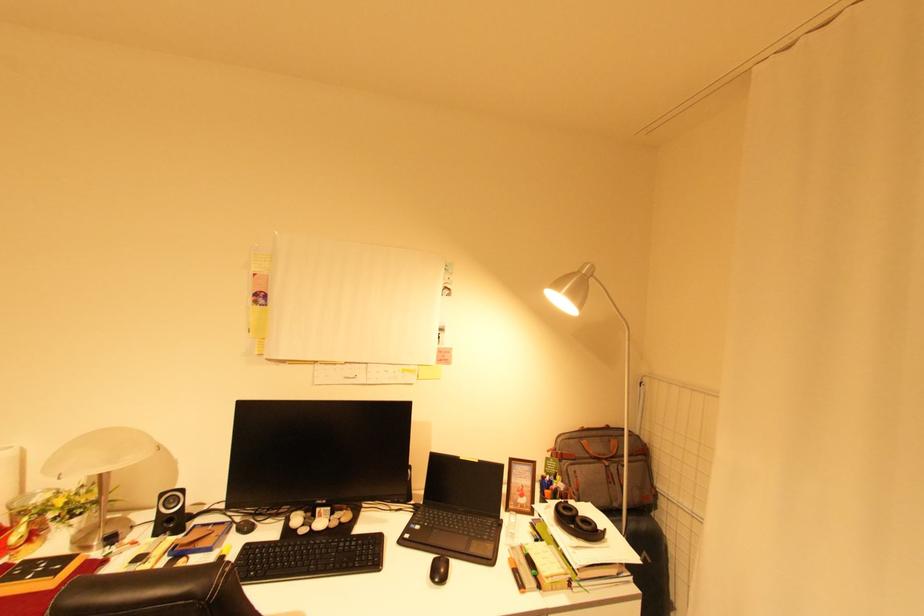
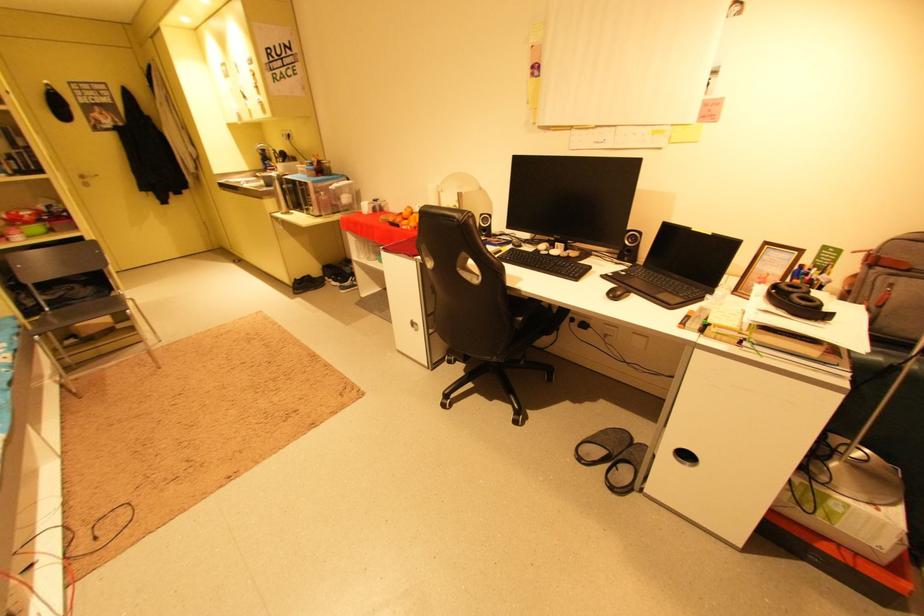
Where in the second image is the point corresponding to (582,460) from the first image?

(917, 272)